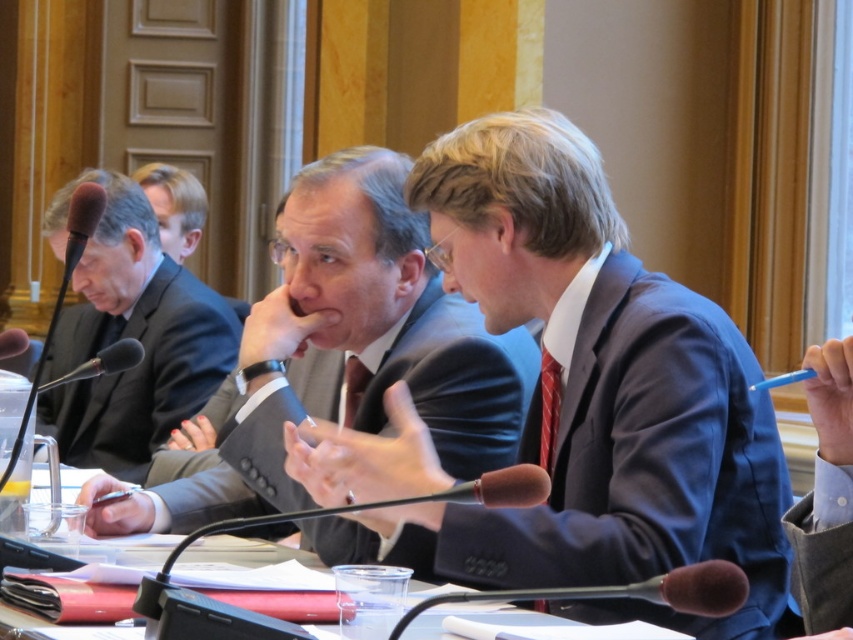
Question: Is dark gray suit at center positioned behind black matte suit at left?

Choices:
 (A) no
 (B) yes

Answer: (A)

Question: Which point appears closest to the camera in this image?

Choices:
 (A) (107, 417)
 (B) (498, 458)
 (C) (717, 502)

Answer: (C)

Question: Can you confirm if blue suit at center is positioned to the right of black matte suit at left?

Choices:
 (A) yes
 (B) no

Answer: (A)

Question: Which point is closer to the camera taking this photo?

Choices:
 (A) (424, 401)
 (B) (733, 502)

Answer: (B)

Question: Estimate the real-world distances between objects in this image. Which object is closer to the blue suit at center?

Choices:
 (A) black matte suit at left
 (B) dark gray suit at center

Answer: (B)

Question: Can you confirm if dark gray suit at center is wider than black matte suit at left?

Choices:
 (A) no
 (B) yes

Answer: (B)